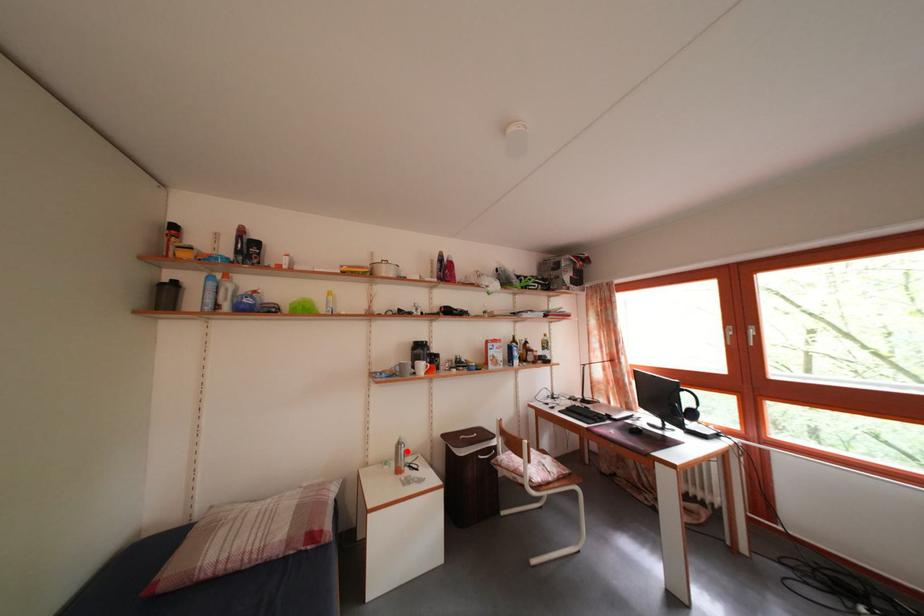
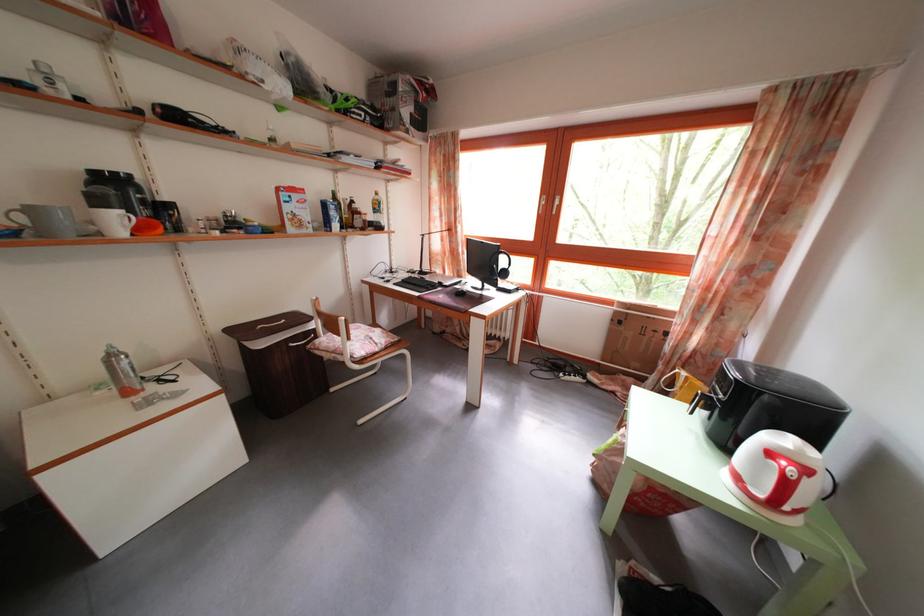
The point at the highlighted location is marked in the first image. Where is the corresponding point in the second image?

(118, 363)